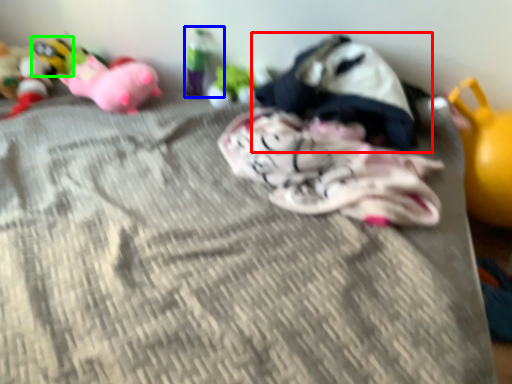
Question: Which is farther away from toy (highlighted by a red box)? toy (highlighted by a blue box) or toy (highlighted by a green box)?

Choices:
 (A) toy
 (B) toy

Answer: (B)